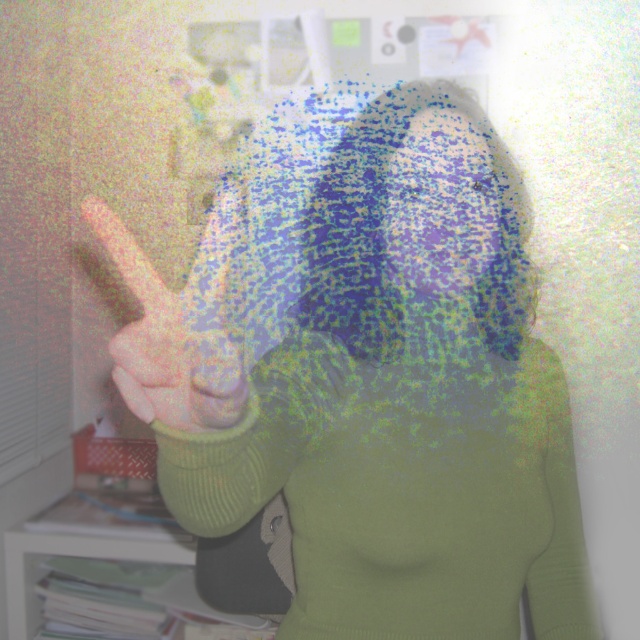
You are a person who wants to pick up the smooth blue fabric at center. Your hand is currently at the smooth skin hand at center. To reach the fabric, should you move your hand to your left or right?

The smooth blue fabric at center is to the right of the smooth skin hand at center, so you should move your hand to the right to reach it.

In the scene shown: You are standing in a room with a green ribbed sweater at center. You want to pick up the sweater without moving your feet. Can you reach it?

The green ribbed sweater at center is 45.24 centimeters away from camera, so yes, you can reach it without moving your feet.

You are standing in the room and want to reach both the point at coordinates point (216, 268) and point (129, 404). Which point will you touch first as you move forward?

You will touch point (129, 404) first because it is closer to you than point (216, 268) which is further away.